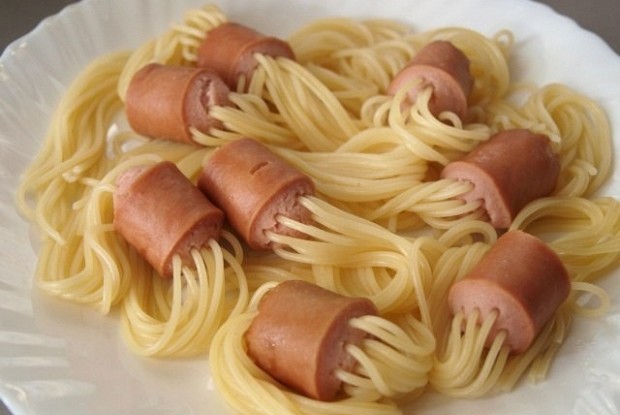
The width and height of the screenshot is (620, 415). Identify the location of empty space bottom left of plate. (67, 376).